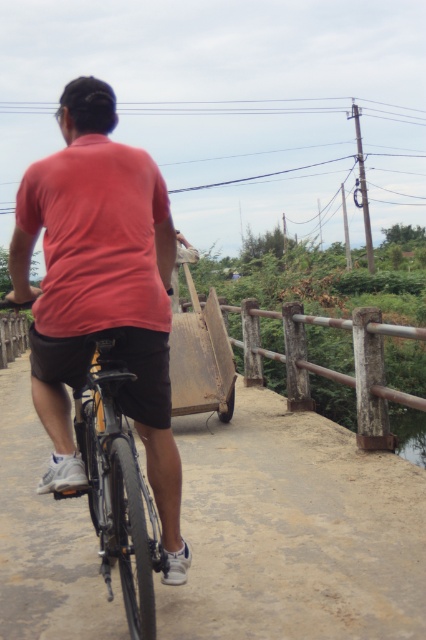
Between point (207, 598) and point (124, 339), which one is positioned behind?

Positioned behind is point (207, 598).

Does matte black bicycle at center have a larger size compared to matte red shirt at center?

Incorrect, matte black bicycle at center is not larger than matte red shirt at center.

Does point (348, 529) come behind point (150, 291)?

Yes, it is.

The width and height of the screenshot is (426, 640). I want to click on matte black bicycle at center, so click(293, 531).

Is matte black bicycle at center above shiny metallic bicycle at center?

Incorrect, matte black bicycle at center is not positioned above shiny metallic bicycle at center.

Between point (336, 467) and point (123, 550), which one is positioned in front?

Positioned in front is point (123, 550).

The image size is (426, 640). What are the coordinates of `matte black bicycle at center` in the screenshot? It's located at (293, 531).

Can you confirm if matte red shirt at center is positioned below shiny metallic bicycle at center?

Incorrect, matte red shirt at center is not positioned below shiny metallic bicycle at center.

Find the location of a particular element. matte red shirt at center is located at coordinates (100, 291).

Find the location of a particular element. The height and width of the screenshot is (640, 426). matte red shirt at center is located at coordinates (100, 291).